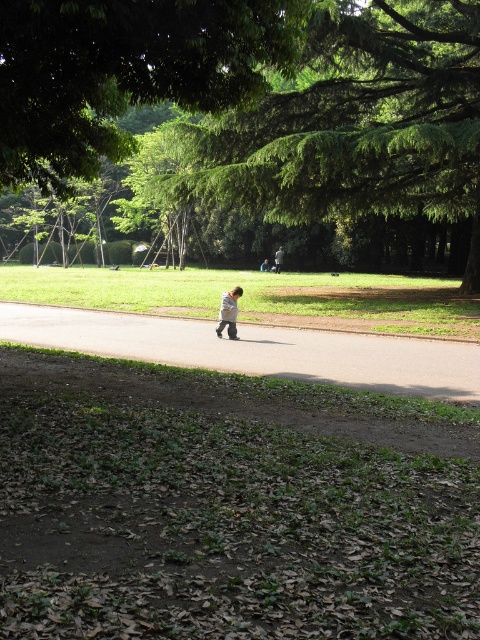
Question: Observing the image, what is the correct spatial positioning of green leafy tree at upper center in reference to smooth asphalt path at center?

Choices:
 (A) right
 (B) left

Answer: (B)

Question: Which point is farther from the camera taking this photo?

Choices:
 (A) (25, 176)
 (B) (226, 305)
 (C) (279, 260)

Answer: (C)

Question: Does green leafy tree at upper center have a smaller size compared to smooth asphalt path at center?

Choices:
 (A) no
 (B) yes

Answer: (B)

Question: Based on their relative distances, which object is farther from the smooth asphalt path at center?

Choices:
 (A) light gray fabric jacket at center
 (B) light gray cotton shirt at center
 (C) green leafy tree at upper center

Answer: (A)

Question: Which point is farther to the camera?

Choices:
 (A) light gray cotton shirt at center
 (B) green leafy tree at center
 (C) light gray fabric jacket at center
 (D) green leafy tree at upper center

Answer: (C)

Question: Can you confirm if green leafy tree at center is bigger than light gray cotton shirt at center?

Choices:
 (A) yes
 (B) no

Answer: (A)